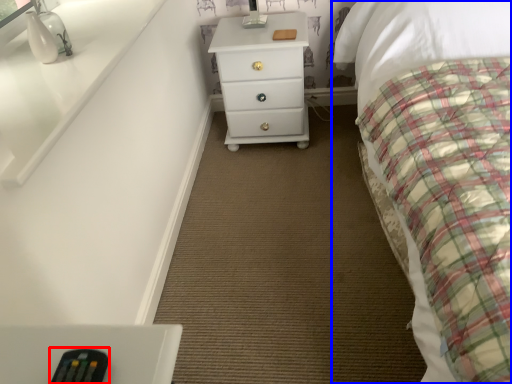
Question: Which of the following is the closest to the observer, remote (highlighted by a red box) or bed (highlighted by a blue box)?

Choices:
 (A) remote
 (B) bed

Answer: (B)